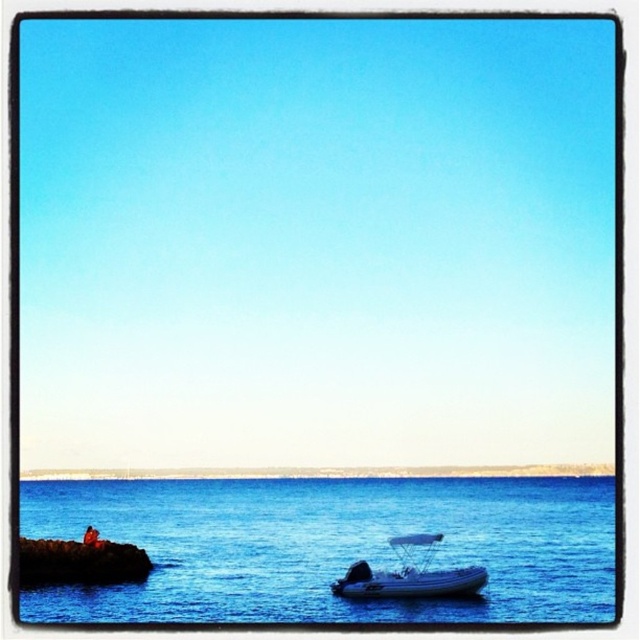
How distant is blue water at lower left from white rubber boat at lower center?

117.34 meters

Is blue water at lower left below white rubber boat at lower center?

Correct, blue water at lower left is located below white rubber boat at lower center.

Is point (481, 561) behind point (340, 584)?

Yes.

Locate an element on the screen. blue water at lower left is located at coordinates pos(330,547).